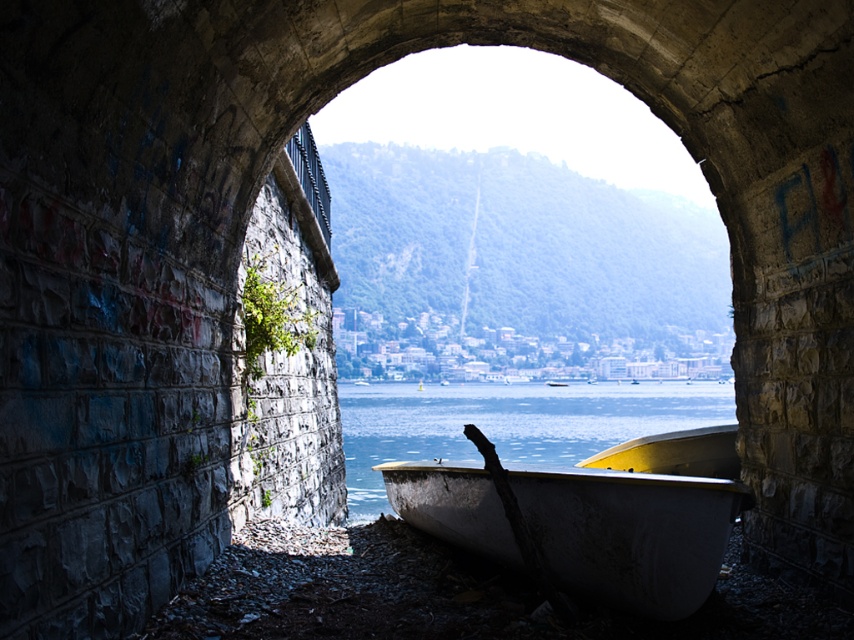
Question: Can you confirm if white weathered canoe at lower right is bigger than clear water at boat right?

Choices:
 (A) yes
 (B) no

Answer: (B)

Question: Which of the following is the closest to the observer?

Choices:
 (A) white weathered canoe at lower right
 (B) clear water at boat right

Answer: (A)

Question: Is white weathered canoe at lower right to the left of clear water at boat right from the viewer's perspective?

Choices:
 (A) yes
 (B) no

Answer: (A)

Question: Does white weathered canoe at lower right appear under clear water at boat right?

Choices:
 (A) no
 (B) yes

Answer: (A)

Question: Among these points, which one is farthest from the camera?

Choices:
 (A) (641, 524)
 (B) (588, 435)

Answer: (B)